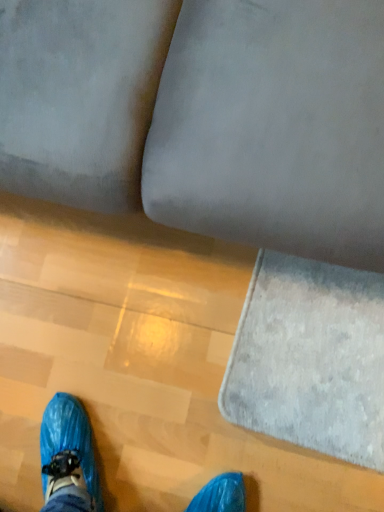
Question: Is velvet gray couch at center in front of or behind white fluffy mat at lower right in the image?

Choices:
 (A) front
 (B) behind

Answer: (A)

Question: Is velvet gray couch at center inside the boundaries of white fluffy mat at lower right, or outside?

Choices:
 (A) inside
 (B) outside

Answer: (B)

Question: In terms of width, does velvet gray couch at center look wider or thinner when compared to white fluffy mat at lower right?

Choices:
 (A) wide
 (B) thin

Answer: (A)

Question: Is white fluffy mat at lower right to the left or to the right of velvet gray couch at center in the image?

Choices:
 (A) left
 (B) right

Answer: (B)

Question: Looking at their shapes, would you say white fluffy mat at lower right is wider or thinner than velvet gray couch at center?

Choices:
 (A) wide
 (B) thin

Answer: (B)

Question: From a real-world perspective, relative to velvet gray couch at center, is white fluffy mat at lower right vertically above or below?

Choices:
 (A) above
 (B) below

Answer: (B)

Question: From the image's perspective, is white fluffy mat at lower right located above or below velvet gray couch at center?

Choices:
 (A) above
 (B) below

Answer: (B)